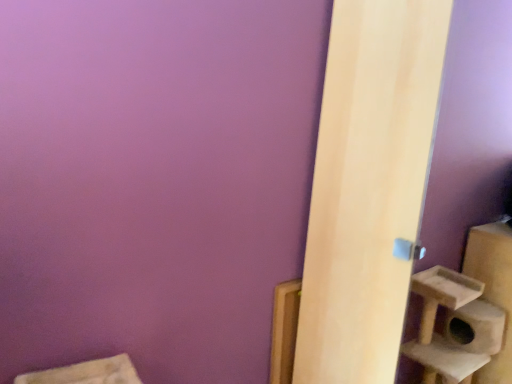
What do you see at coordinates (284, 330) in the screenshot? The image size is (512, 384). I see `wooden frame at lower right` at bounding box center [284, 330].

Locate an element on the screen. Image resolution: width=512 pixels, height=384 pixels. wooden frame at lower right is located at coordinates (284, 330).

Image resolution: width=512 pixels, height=384 pixels. Describe the element at coordinates (368, 186) in the screenshot. I see `light wood door at right` at that location.

The width and height of the screenshot is (512, 384). I want to click on light wood door at right, so click(368, 186).

Locate an element on the screen. This screenshot has height=384, width=512. wooden frame at lower right is located at coordinates (284, 330).

Which object is positioned more to the right, light wood door at right or wooden frame at lower right?

light wood door at right.

Is light wood door at right further to the viewer compared to wooden frame at lower right?

No, light wood door at right is closer to the camera.

Is point (373, 136) closer or farther from the camera than point (287, 344)?

Clearly, point (373, 136) is closer to the camera than point (287, 344).

Looking at this image, from the image's perspective, does light wood door at right appear higher than wooden frame at lower right?

Indeed, from the image's perspective, light wood door at right is shown above wooden frame at lower right.

From a real-world perspective, is light wood door at right under wooden frame at lower right?

Actually, light wood door at right is physically above wooden frame at lower right in the real world.

Considering the relative sizes of light wood door at right and wooden frame at lower right in the image provided, is light wood door at right thinner than wooden frame at lower right?

No.

Is light wood door at right taller than wooden frame at lower right?

Yes.

Between light wood door at right and wooden frame at lower right, which one has smaller size?

With smaller size is wooden frame at lower right.

Choose the correct answer: Is light wood door at right inside wooden frame at lower right or outside it?

light wood door at right is outside wooden frame at lower right.

Are light wood door at right and wooden frame at lower right far apart?

Actually, light wood door at right and wooden frame at lower right are a little close together.

Could you tell me if light wood door at right is turned towards wooden frame at lower right?

No, light wood door at right is not facing towards wooden frame at lower right.

Can you tell me how much light wood door at right and wooden frame at lower right differ in facing direction?

The angular difference between light wood door at right and wooden frame at lower right is 90.1 degrees.

How much distance is there between light wood door at right and wooden frame at lower right?

light wood door at right and wooden frame at lower right are 40.01 centimeters apart.

Where is `window sill lying below the light wood door at right (from the image's perspective)`? The width and height of the screenshot is (512, 384). window sill lying below the light wood door at right (from the image's perspective) is located at coordinates (284, 330).

Between wooden frame at lower right and light wood door at right, which one appears on the left side from the viewer's perspective?

Positioned to the left is wooden frame at lower right.

Is wooden frame at lower right further to camera compared to light wood door at right?

Yes.

Is point (274, 295) closer or farther from the camera than point (381, 334)?

Clearly, point (274, 295) is more distant from the camera than point (381, 334).

From the image's perspective, is wooden frame at lower right below light wood door at right?

Correct, wooden frame at lower right appears lower than light wood door at right in the image.

From a real-world perspective, who is located higher, wooden frame at lower right or light wood door at right?

In real-world perspective, light wood door at right is above.

Is wooden frame at lower right thinner than light wood door at right?

Yes.

In terms of height, does wooden frame at lower right look taller or shorter compared to light wood door at right?

Clearly, wooden frame at lower right is shorter compared to light wood door at right.

Between wooden frame at lower right and light wood door at right, which one has larger size?

light wood door at right is bigger.

Is wooden frame at lower right located outside light wood door at right?

Absolutely, wooden frame at lower right is external to light wood door at right.

From the picture: Is the surface of wooden frame at lower right in direct contact with light wood door at right?

No, wooden frame at lower right is not making contact with light wood door at right.

Is wooden frame at lower right facing away from light wood door at right?

wooden frame at lower right does not have its back to light wood door at right.

The height and width of the screenshot is (384, 512). Identify the location of window sill that appears on the left of light wood door at right. (284, 330).

What are the coordinates of `door above the wooden frame at lower right (from the image's perspective)` in the screenshot? It's located at (368, 186).

Image resolution: width=512 pixels, height=384 pixels. Identify the location of door above the wooden frame at lower right (from a real-world perspective). (368, 186).